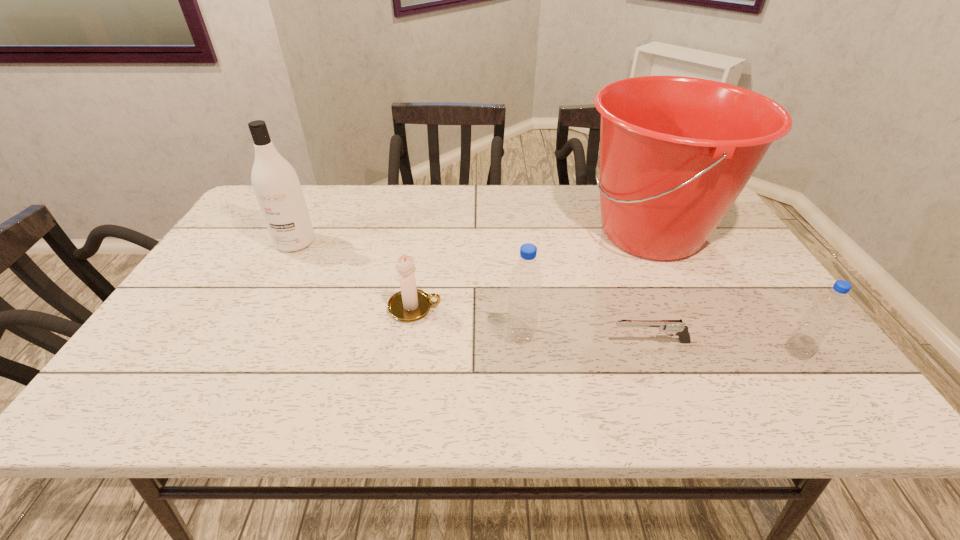
Where is `pistol present at the near edge`? This screenshot has height=540, width=960. pistol present at the near edge is located at coordinates (x=676, y=326).

The height and width of the screenshot is (540, 960). What are the coordinates of `object that is at the left edge` in the screenshot? It's located at tap(275, 183).

At what (x,y) coordinates should I click in order to perform the action: click on water bottle at the right edge. Please return your answer as a coordinate pair (x, y). Image resolution: width=960 pixels, height=540 pixels. Looking at the image, I should click on pos(827,308).

You are a GUI agent. You are given a task and a screenshot of the screen. Output one action in this format:
    pyautogui.click(x=<x>, y=<y>)
    Task: Click on the bucket that is at the right edge
    This screenshot has height=540, width=960.
    Given the screenshot: What is the action you would take?
    pyautogui.click(x=676, y=152)

The height and width of the screenshot is (540, 960). What are the coordinates of `object that is at the far right corner` in the screenshot? It's located at (676, 152).

Identify the location of object present at the near right corner. (827, 308).

Find the location of `vacant space at the far edge of the desktop`. vacant space at the far edge of the desktop is located at coordinates (550, 193).

In the image, there is a desktop. Where is `free space at the near edge`? The height and width of the screenshot is (540, 960). free space at the near edge is located at coordinates (726, 360).

In the image, there is a desktop. At what (x,y) coordinates should I click in order to perform the action: click on vacant space at the left edge. Please return your answer as a coordinate pair (x, y). Looking at the image, I should click on (234, 254).

The width and height of the screenshot is (960, 540). I want to click on vacant space at the right edge of the desktop, so click(x=706, y=252).